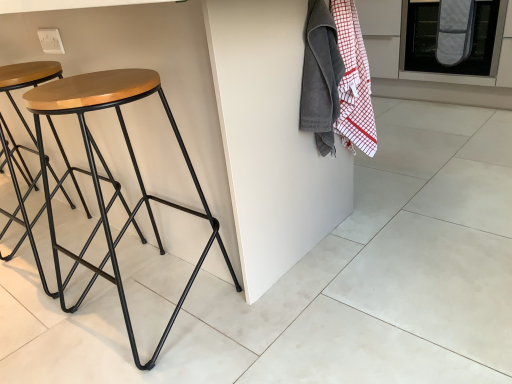
Question: From the image's perspective, relative to velvet-like gray blanket at upper right, is gray quilted oven mitt at upper right above or below?

Choices:
 (A) below
 (B) above

Answer: (B)

Question: Is gray quilted oven mitt at upper right wider or thinner than velvet-like gray blanket at upper right?

Choices:
 (A) thin
 (B) wide

Answer: (B)

Question: Estimate the real-world distances between objects in this image. Which object is farther from the woodenmaterial/texturestool at left?

Choices:
 (A) velvet-like gray blanket at upper right
 (B) white matte tile at lower right
 (C) gray quilted oven mitt at upper right

Answer: (C)

Question: Which object is the closest to the gray quilted oven mitt at upper right?

Choices:
 (A) velvet-like gray blanket at upper right
 (B) white matte tile at lower right
 (C) woodenmaterial/texturestool at left

Answer: (A)